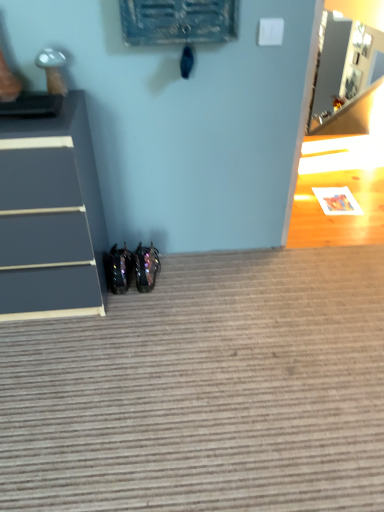
Where is `blank area beneath glossy metallic shoes at lower center, the 2th footwear in the left-to-right sequence (from a real-world perspective)`? This screenshot has height=512, width=384. blank area beneath glossy metallic shoes at lower center, the 2th footwear in the left-to-right sequence (from a real-world perspective) is located at coordinates (149, 275).